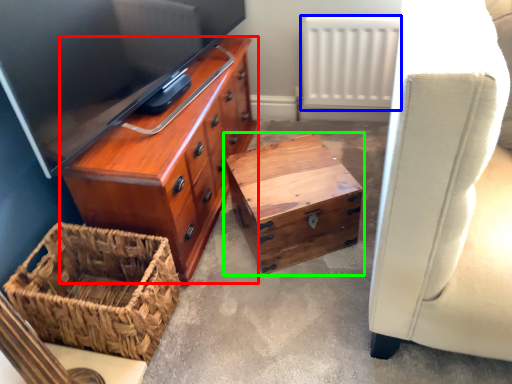
Question: Which object is positioned farthest from chest of drawers (highlighted by a red box)? Select from radiator (highlighted by a blue box) and table (highlighted by a green box).

Choices:
 (A) radiator
 (B) table

Answer: (A)